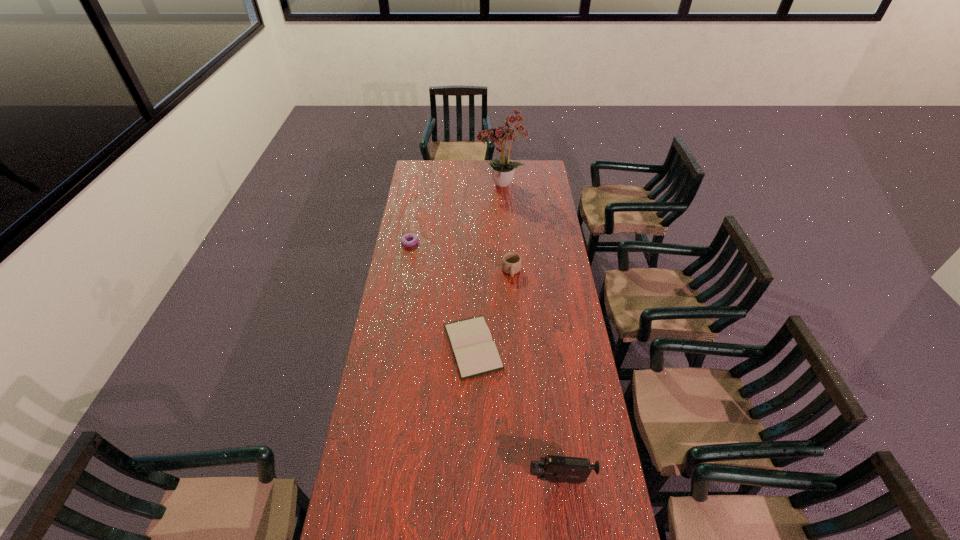
Identify the location of free point located on the front-facing side of the farthest object. This screenshot has width=960, height=540. (418, 185).

Find the location of `vacant space located 0.320m on the front-facing side of the farthest object`. vacant space located 0.320m on the front-facing side of the farthest object is located at coordinates (420, 185).

In order to click on free point located on the front-facing side of the farthest object in this screenshot , I will do `click(439, 185)`.

At what (x,y) coordinates should I click in order to perform the action: click on vacant region located 0.070m on the front-facing side of the camcorder. Please return your answer as a coordinate pair (x, y). The width and height of the screenshot is (960, 540). Looking at the image, I should click on tap(508, 479).

Identify the location of free location located 0.180m on the front-facing side of the camcorder. This screenshot has height=540, width=960. (475, 479).

The image size is (960, 540). In order to click on vacant space situated 0.330m on the front-facing side of the camcorder in this screenshot , I will do `click(430, 479)`.

I want to click on free location located 0.370m on the side of the third shortest object with the handle, so click(x=516, y=342).

You are a GUI agent. You are given a task and a screenshot of the screen. Output one action in this format:
    pyautogui.click(x=<x>, y=<y>)
    Task: Click on the vacant space located on the front of the fourth nearest object
    Image resolution: width=960 pixels, height=540 pixels.
    Given the screenshot: What is the action you would take?
    pyautogui.click(x=407, y=258)

Locate an element on the screen. free space located 0.070m on the front of the fourth farthest object is located at coordinates (472, 396).

This screenshot has height=540, width=960. I want to click on object that is at the far edge, so click(x=503, y=170).